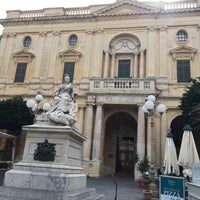
Find the location of a particular element. double door windows is located at coordinates (20, 72), (66, 66), (180, 67).